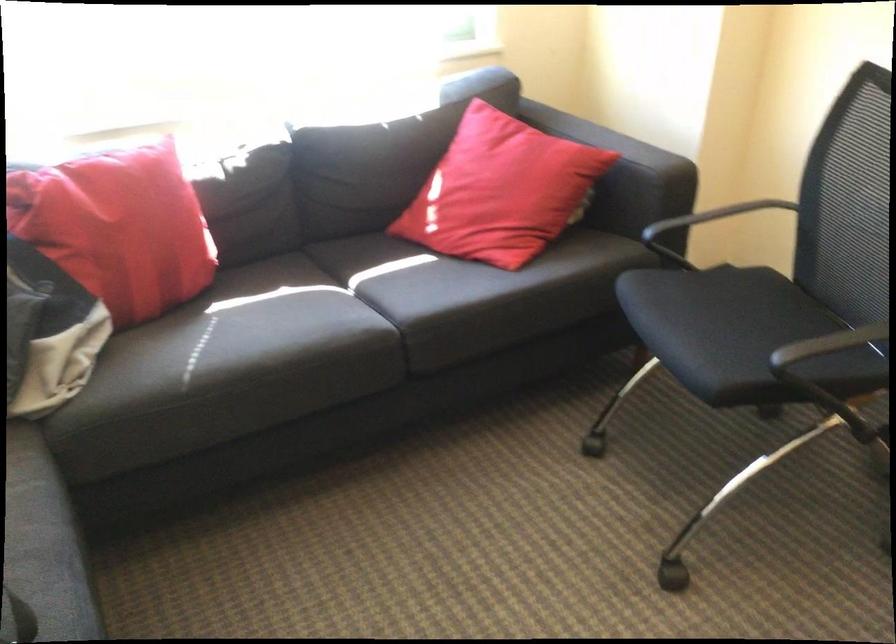
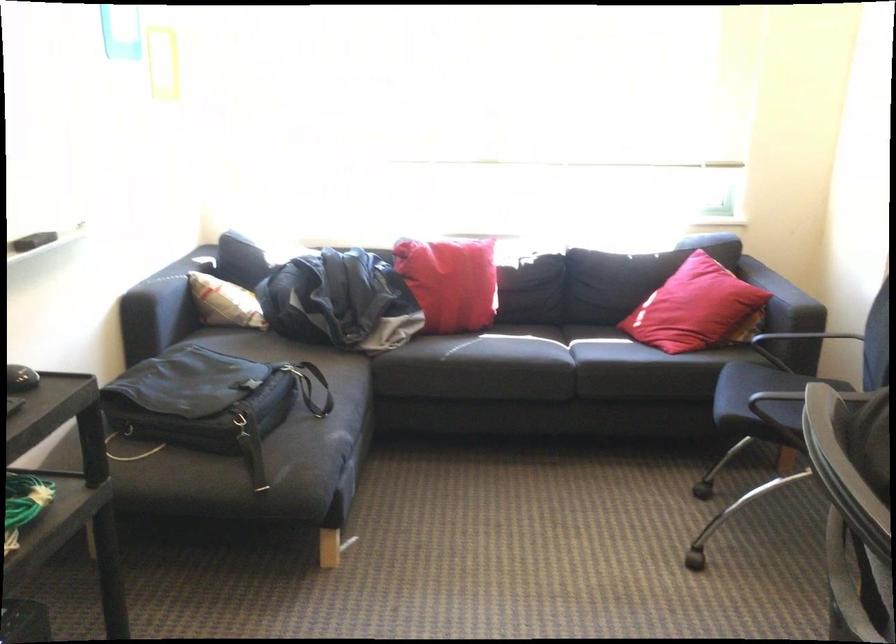
Where in the second image is the point corresponding to the point at 672,214 from the first image?

(802, 337)